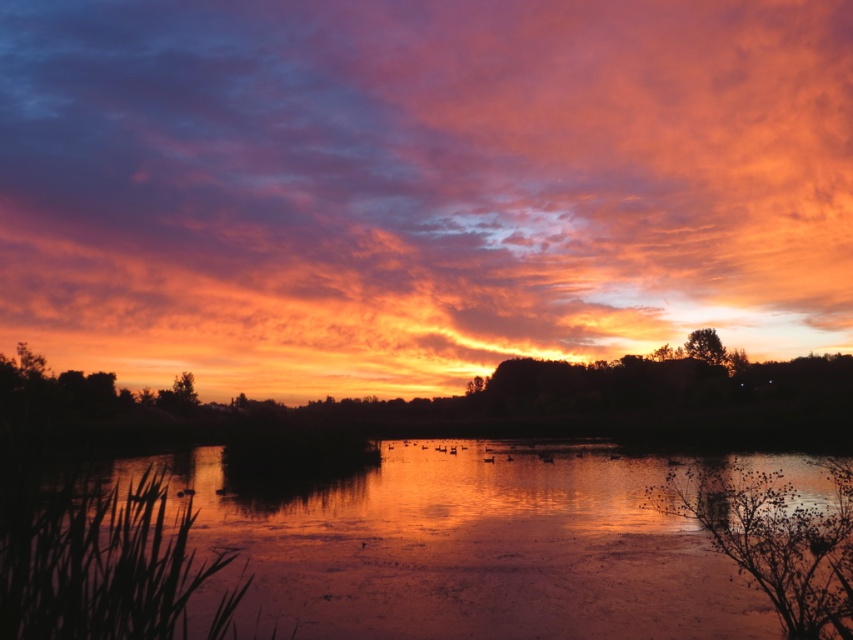
Is matte orange cloud at upper center to the right of glossy water at center from the viewer's perspective?

Yes, matte orange cloud at upper center is to the right of glossy water at center.

Between matte orange cloud at upper center and glossy water at center, which one appears on the right side from the viewer's perspective?

Positioned to the right is matte orange cloud at upper center.

Between point (157, 96) and point (543, 604), which one is positioned behind?

Positioned behind is point (157, 96).

The image size is (853, 640). In order to click on matte orange cloud at upper center in this screenshot , I will do `click(418, 186)`.